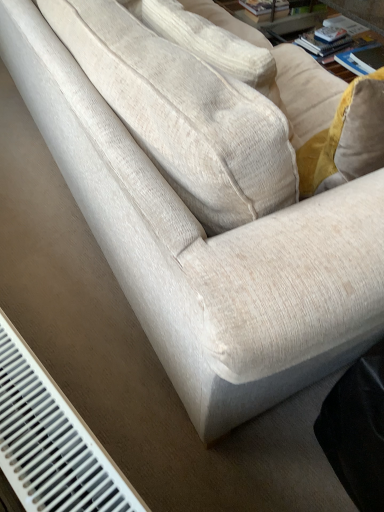
In order to face white plastic radiator at lower left, should I rotate leftwards or rightwards?

Turn left approximately 23.150 degrees to face it.

The image size is (384, 512). What do you see at coordinates (52, 441) in the screenshot? I see `white plastic radiator at lower left` at bounding box center [52, 441].

Identify the location of white plastic radiator at lower left. The width and height of the screenshot is (384, 512). (52, 441).

The height and width of the screenshot is (512, 384). Find the location of `white plastic radiator at lower left`. white plastic radiator at lower left is located at coordinates (52, 441).